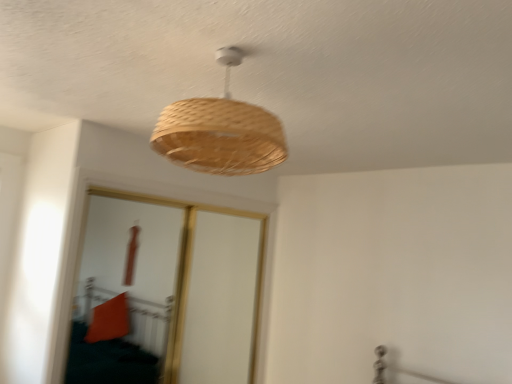
The height and width of the screenshot is (384, 512). Describe the element at coordinates (166, 292) in the screenshot. I see `clear glass screen door at center` at that location.

Where is `clear glass screen door at center`? The image size is (512, 384). clear glass screen door at center is located at coordinates (166, 292).

Locate an element on the screen. The image size is (512, 384). clear glass screen door at center is located at coordinates (166, 292).